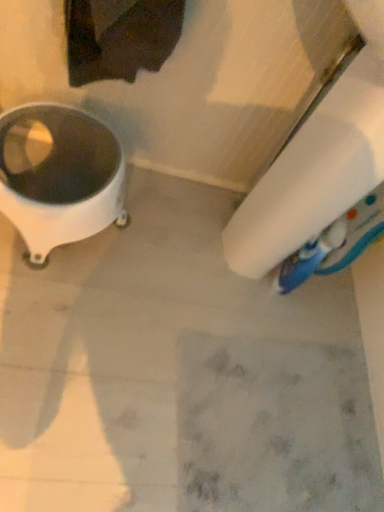
Question: Should I look upward or downward to see white glossy toilet paper at lower right?

Choices:
 (A) down
 (B) up

Answer: (B)

Question: Should I look upward or downward to see white glossy waste container at left?

Choices:
 (A) up
 (B) down

Answer: (A)

Question: Does white glossy toilet paper at lower right come behind white glossy waste container at left?

Choices:
 (A) yes
 (B) no

Answer: (B)

Question: Is white glossy toilet paper at lower right looking in the opposite direction of white glossy waste container at left?

Choices:
 (A) yes
 (B) no

Answer: (B)

Question: Is white glossy toilet paper at lower right outside white glossy waste container at left?

Choices:
 (A) no
 (B) yes

Answer: (B)

Question: From the image's perspective, is white glossy toilet paper at lower right on top of white glossy waste container at left?

Choices:
 (A) yes
 (B) no

Answer: (A)

Question: Is white glossy waste container at left inside white glossy toilet paper at lower right?

Choices:
 (A) no
 (B) yes

Answer: (A)

Question: Is white glossy toilet paper at lower right shorter than white glossy waste container at left?

Choices:
 (A) yes
 (B) no

Answer: (B)

Question: From a real-world perspective, is white glossy waste container at left located beneath white glossy toilet paper at lower right?

Choices:
 (A) no
 (B) yes

Answer: (B)

Question: Does white glossy waste container at left have a larger size compared to white glossy toilet paper at lower right?

Choices:
 (A) yes
 (B) no

Answer: (B)

Question: Is white glossy waste container at left outside white glossy toilet paper at lower right?

Choices:
 (A) no
 (B) yes

Answer: (B)

Question: Considering the relative positions of white glossy waste container at left and white glossy toilet paper at lower right in the image provided, is white glossy waste container at left behind white glossy toilet paper at lower right?

Choices:
 (A) no
 (B) yes

Answer: (B)

Question: Is white glossy waste container at left beside white glossy toilet paper at lower right?

Choices:
 (A) yes
 (B) no

Answer: (B)

Question: Could you tell me if white glossy waste container at left is facing white glossy toilet paper at lower right?

Choices:
 (A) yes
 (B) no

Answer: (B)

Question: Is white glossy toilet paper at lower right bigger or smaller than white glossy waste container at left?

Choices:
 (A) big
 (B) small

Answer: (A)